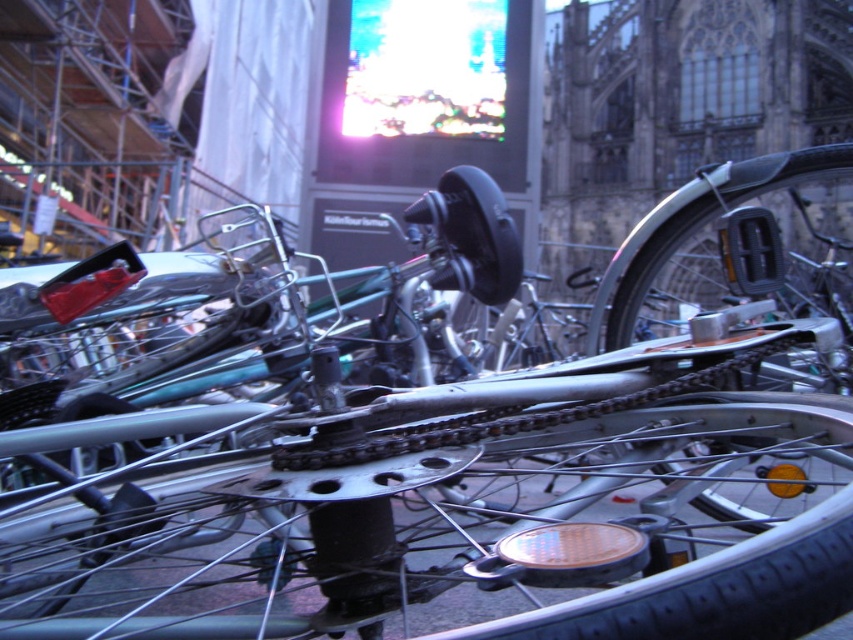
Question: Can you confirm if silver metallic bicycle wheel at center is positioned to the right of shiny metallic chainring at center?

Choices:
 (A) yes
 (B) no

Answer: (B)

Question: Which point is closer to the camera?

Choices:
 (A) silver metallic bicycle wheel at center
 (B) shiny metallic chainring at center

Answer: (A)

Question: Is silver metallic bicycle wheel at center bigger than shiny metallic chainring at center?

Choices:
 (A) no
 (B) yes

Answer: (B)

Question: Where is silver metallic bicycle wheel at center located in relation to shiny metallic chainring at center in the image?

Choices:
 (A) below
 (B) above

Answer: (A)